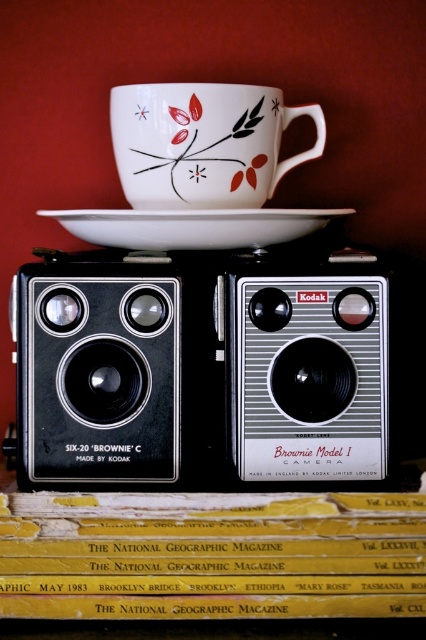
What is the coordinate of the black rubber speaker at center?

The coordinate of the black rubber speaker at center is at point (97, 378).

You are setting up a display for a photography exhibition and need to place the black plastic speaker at center and the porcelain cup with floral design at upper center. According to the scene, which object is taller?

The black plastic speaker at center is taller than the porcelain cup with floral design at upper center.

You are standing in front of the vintage camera setup. There are two points marked on the image. One is at coordinate point (241, 458) and the other at point (198, 96). Which point is closer to you?

Point (241, 458) is closer to the viewer than point (198, 96).